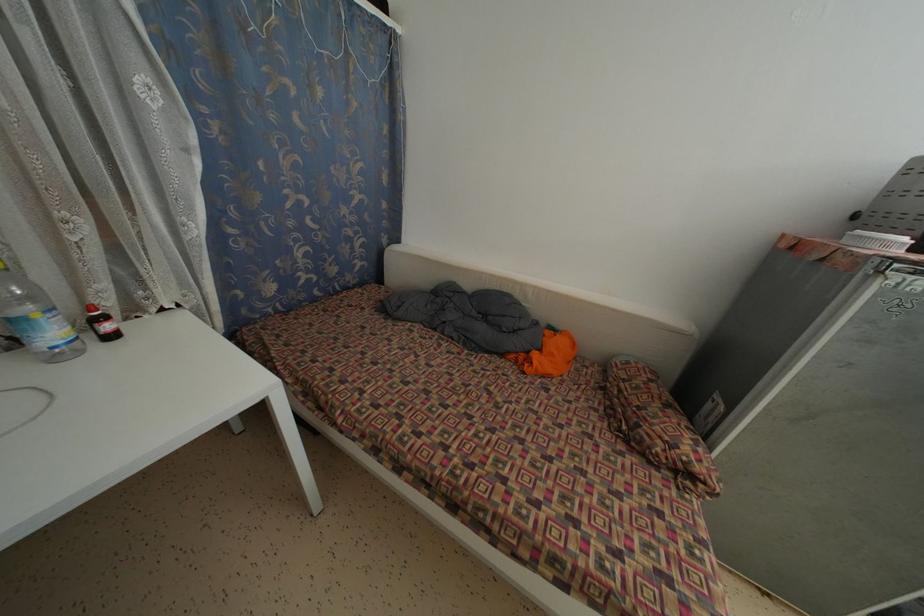
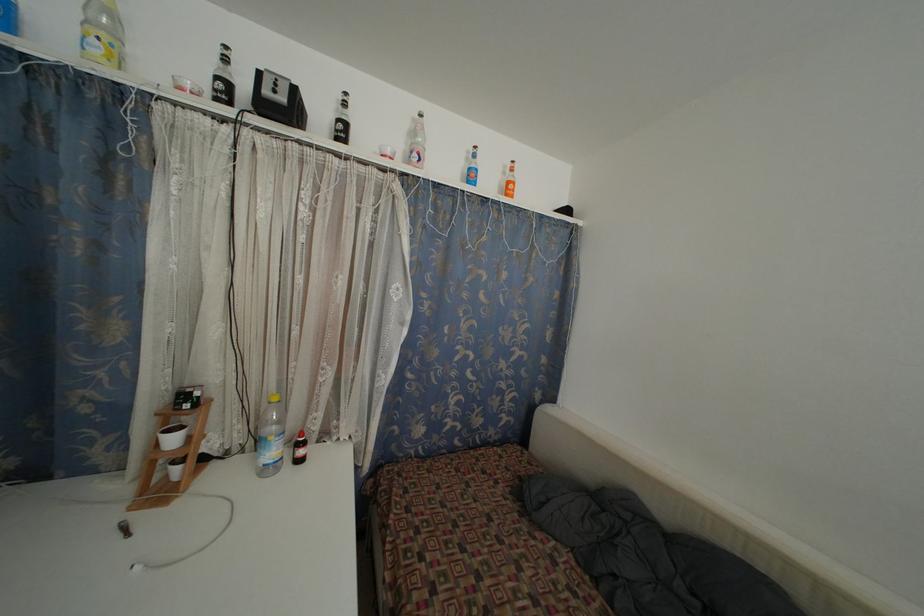
Locate, in the second image, the point that corresponds to pixel 41 321 in the first image.

(274, 444)